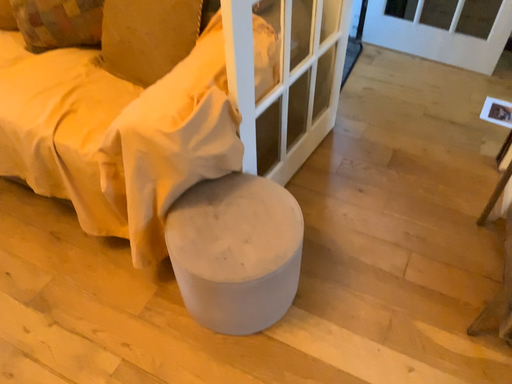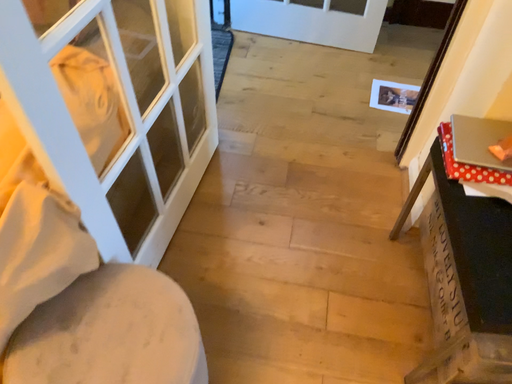
Question: Which way did the camera rotate in the video?

Choices:
 (A) rotated right
 (B) rotated left

Answer: (A)